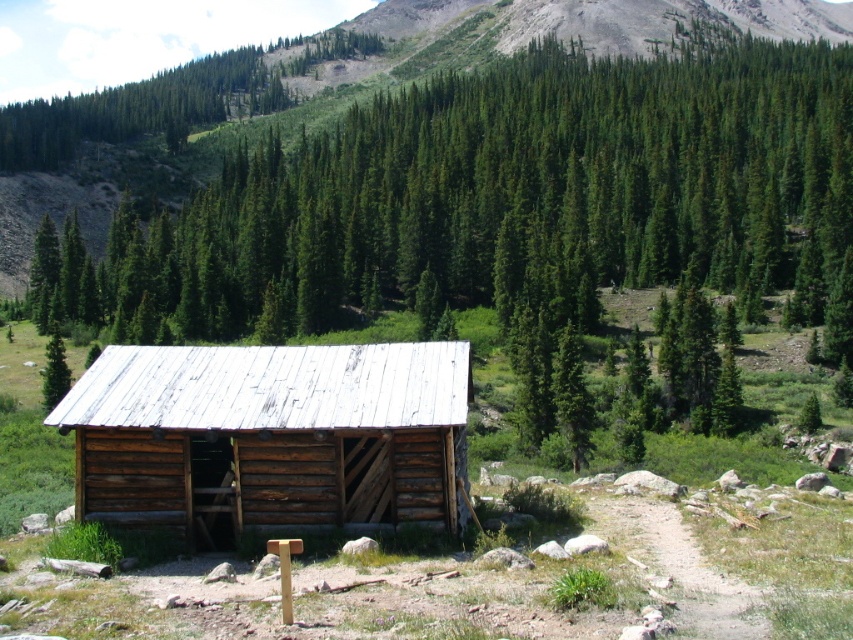
Who is taller, weathered wood cabin at center or green matte tree at center?

With more height is weathered wood cabin at center.

At what (x,y) coordinates should I click in order to perform the action: click on weathered wood cabin at center. Please return your answer as a coordinate pair (x, y). The height and width of the screenshot is (640, 853). Looking at the image, I should click on (502, 209).

Can you confirm if weathered wood shed at center is positioned to the left of green matte tree at center?

In fact, weathered wood shed at center is to the right of green matte tree at center.

Which of these two, weathered wood shed at center or green matte tree at center, stands taller?

With more height is green matte tree at center.

Between point (390, 417) and point (64, 365), which one is positioned in front?

Point (390, 417) is more forward.

The width and height of the screenshot is (853, 640). In order to click on weathered wood shed at center in this screenshot , I will do `click(271, 435)`.

Who is positioned more to the right, weathered wood cabin at center or weathered wood shed at center?

From the viewer's perspective, weathered wood cabin at center appears more on the right side.

Is weathered wood cabin at center to the left of weathered wood shed at center from the viewer's perspective?

No, weathered wood cabin at center is not to the left of weathered wood shed at center.

Identify the location of weathered wood cabin at center. The image size is (853, 640). (502, 209).